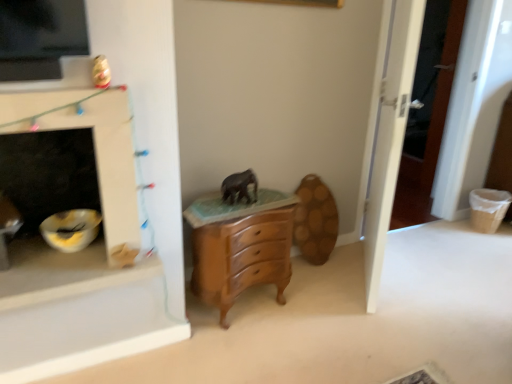
In order to click on empty space that is in between white wooden door at right and wooden chest of drawers at center in this screenshot , I will do `click(313, 293)`.